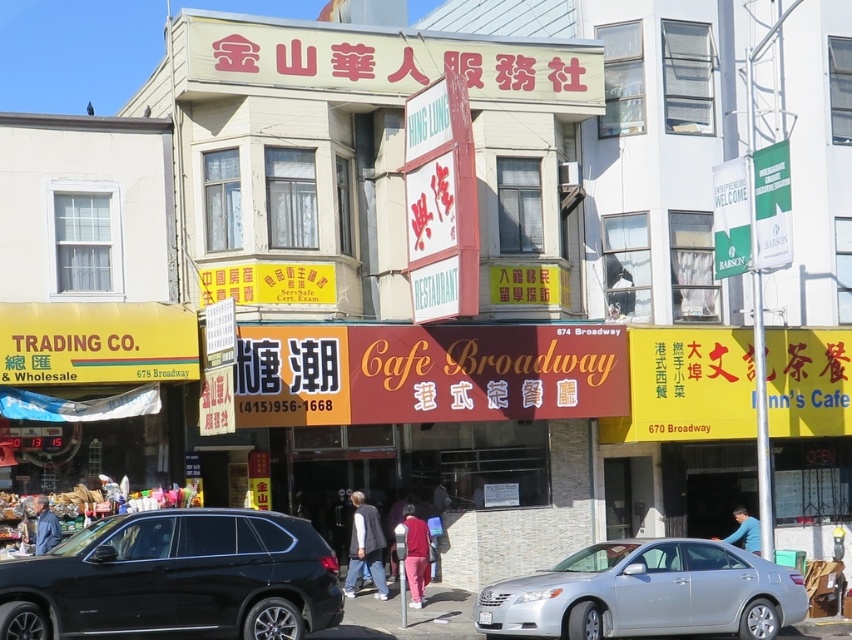
Is silver metallic sedan at center closer to camera compared to blue fabric shirt at lower right?

Yes, silver metallic sedan at center is closer to the viewer.

Who is lower down, silver metallic sedan at center or blue fabric shirt at lower right?

Positioned lower is silver metallic sedan at center.

You are a GUI agent. You are given a task and a screenshot of the screen. Output one action in this format:
    pyautogui.click(x=<x>, y=<y>)
    Task: Click on the silver metallic sedan at center
    
    Given the screenshot: What is the action you would take?
    pyautogui.click(x=646, y=593)

Looking at this image, is the position of dark gray sweater at center less distant than that of blue fabric shirt at lower right?

Yes, dark gray sweater at center is closer to the viewer.

Can you confirm if dark gray sweater at center is thinner than blue fabric shirt at lower right?

No, dark gray sweater at center is not thinner than blue fabric shirt at lower right.

I want to click on dark gray sweater at center, so click(x=366, y=547).

Identify the location of dark gray sweater at center. This screenshot has width=852, height=640. (366, 547).

Does shiny black suv at lower left appear on the left side of blue fabric shirt at lower right?

Yes, shiny black suv at lower left is to the left of blue fabric shirt at lower right.

Is point (95, 589) positioned behind point (747, 540)?

No.

Who is more distant from viewer, (10, 589) or (746, 547)?

The point (746, 547) is more distant.

Locate an element on the screen. shiny black suv at lower left is located at coordinates (176, 579).